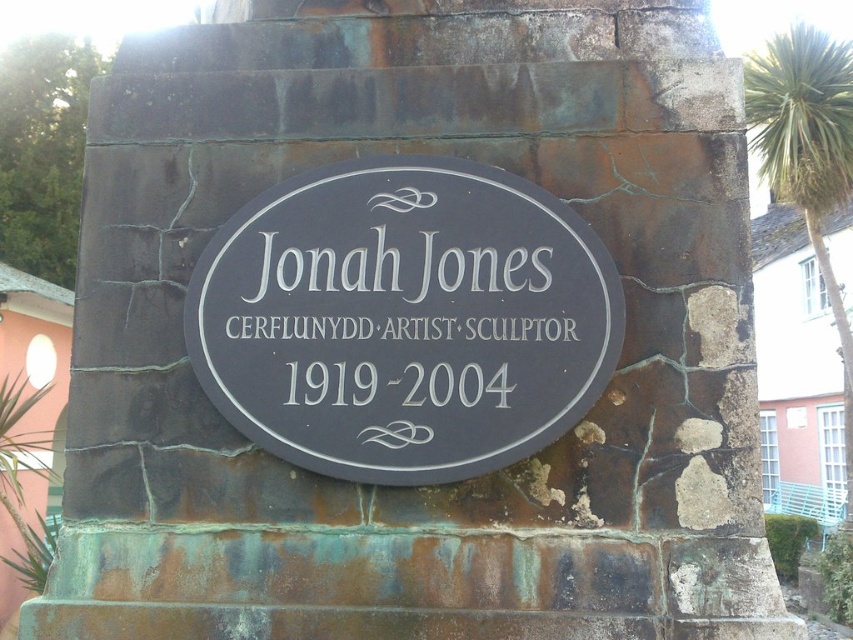
You are standing 3 meters away from the plaque. Can you reach the point at coordinates point (529, 241) on the plaque without moving closer?

The distance of point (529, 241) from viewer is 3.49 meters, so you are currently 3 meters away. Since 3.49 meters is farther than 3 meters, you cannot reach the point without moving closer.

You are standing in front of the stone structure and want to locate the matte black plaque at center. According to the coordinates provided, where should you look to find it?

The matte black plaque at center is located at the 2D coordinates point (x=387, y=317) on the stone structure.

You are a visitor at a historical site and notice two plaques on a stone structure. You see the black polished stone plaque at center and the matte black plaque at center. Which one is positioned higher up on the stone structure?

The black polished stone plaque at center is positioned higher up on the stone structure as it is located above the matte black plaque at center.